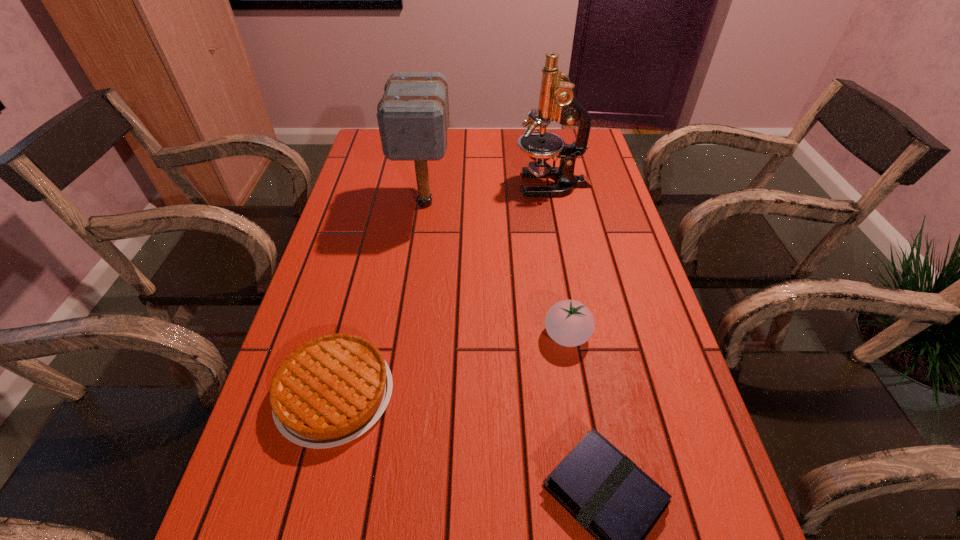
Identify the location of microscope. The width and height of the screenshot is (960, 540). (557, 101).

Locate an element on the screen. Image resolution: width=960 pixels, height=540 pixels. mallet is located at coordinates (413, 115).

At what (x,y) coordinates should I click in order to perform the action: click on the third shortest object. Please return your answer as a coordinate pair (x, y). This screenshot has width=960, height=540. Looking at the image, I should click on (570, 323).

Where is `pie`? pie is located at coordinates (329, 391).

Where is `vacant region located at the eyepiece of the microscope`? Image resolution: width=960 pixels, height=540 pixels. vacant region located at the eyepiece of the microscope is located at coordinates (400, 184).

Locate an element on the screen. This screenshot has width=960, height=540. blank space located at the eyepiece of the microscope is located at coordinates (391, 184).

You are a GUI agent. You are given a task and a screenshot of the screen. Output one action in this format:
    pyautogui.click(x=<x>, y=<y>)
    Task: Click on the free space located 0.350m at the eyepiece of the microscope
    The image size is (960, 540).
    Given the screenshot: What is the action you would take?
    pyautogui.click(x=400, y=184)

Identify the location of free space located 0.100m on the striking surface of the mallet. The height and width of the screenshot is (540, 960). (419, 252).

The height and width of the screenshot is (540, 960). What are the coordinates of `vacant space located on the front of the tomato` in the screenshot? It's located at (575, 385).

The height and width of the screenshot is (540, 960). In order to click on vacant space situated on the right of the pie in this screenshot , I will do `click(577, 394)`.